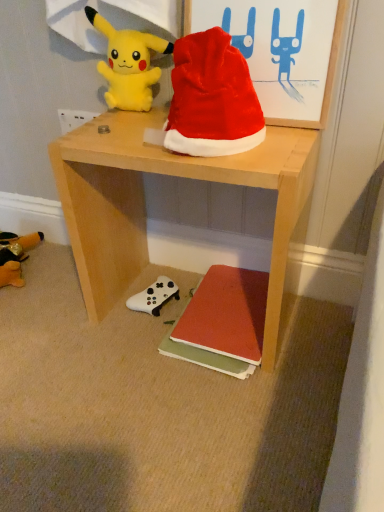
Find the location of `blank space situated above light wood desk at center (from a real-world perspective)`. blank space situated above light wood desk at center (from a real-world perspective) is located at coordinates (176, 146).